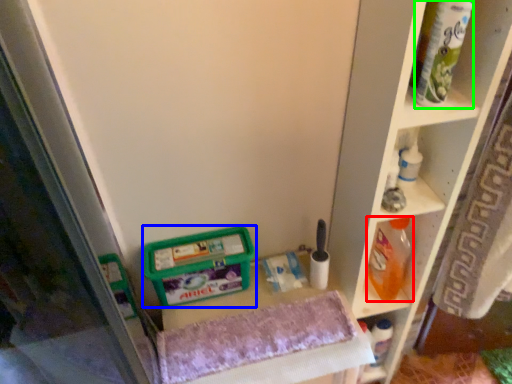
Question: Which is nearer to the cleaning product (highlighted by a red box)? wide (highlighted by a blue box) or tube (highlighted by a green box).

Choices:
 (A) wide
 (B) tube

Answer: (A)